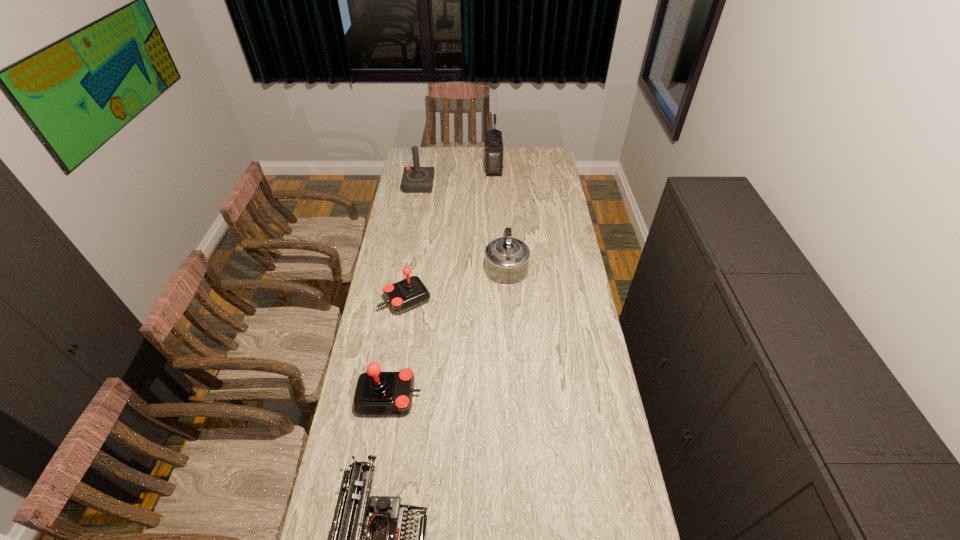
Locate an element on the screen. The height and width of the screenshot is (540, 960). free space in the image that satisfies the following two spatial constraints: 1. on the front-facing side of the lantern; 2. on the rectangular base of the tallest joystick is located at coordinates (494, 185).

The image size is (960, 540). I want to click on free space that satisfies the following two spatial constraints: 1. on the front-facing side of the tallest object; 2. on the rectangular base of the farthest joystick, so click(494, 185).